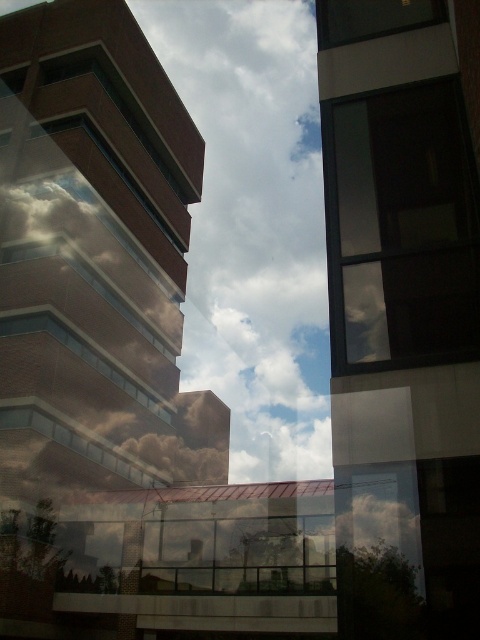
You are standing in a room with a large window. You see a point at coordinates (x=254, y=225). What object is located at that point?

The point at coordinates (x=254, y=225) corresponds to a white fluffy cloud at center.

You are an architect designing a new building and are analyzing the image. You need to determine if the white fluffy cloud at center can fit within the transparent glass window at upper right when viewed from the current perspective. Can it fit?

The white fluffy cloud at center is wider than the transparent glass window at upper right, so it cannot fit within the window when viewed from the current perspective.

You are an architect designing a new building and want to ensure the reflection of the white fluffy cloud at center is visible through the transparent glass window at upper right. Based on their sizes, will the cloud be fully visible in the reflection?

The white fluffy cloud at center is taller than the transparent glass window at upper right, so the cloud will not be fully visible in the reflection as the window is smaller in height than the cloud.